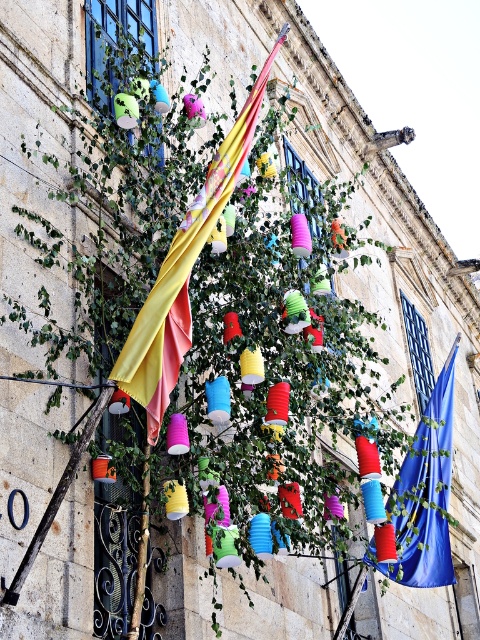
You are an event organizer planning to replace the smaller flag with a new one. Which flag among the yellow fabric flag at center and the blue fabric flag at center should be replaced?

The yellow fabric flag at center has a smaller size compared to the blue fabric flag at center, so the yellow fabric flag at center should be replaced.